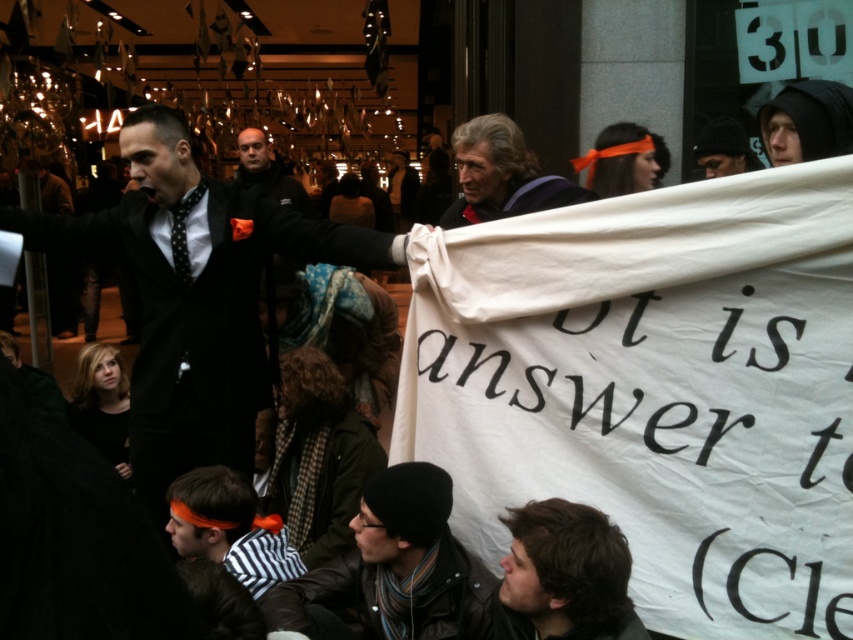
Question: Among these points, which one is nearest to the camera?

Choices:
 (A) tap(363, 573)
 (B) tap(196, 552)

Answer: (A)

Question: Can you confirm if black matte suit at center is positioned to the left of dark brown hair at lower right?

Choices:
 (A) no
 (B) yes

Answer: (B)

Question: Where is black knit cap at lower center located in relation to black knit cap at upper right in the image?

Choices:
 (A) left
 (B) right

Answer: (A)

Question: Which object is farther from the camera taking this photo?

Choices:
 (A) striped fabric shirt at lower left
 (B) gray woolen scarf at center

Answer: (B)

Question: Which point is closer to the camera?

Choices:
 (A) (254, 173)
 (B) (213, 486)
 (C) (155, 364)

Answer: (B)

Question: Can you confirm if black matte suit at center is positioned below gray woolen scarf at center?

Choices:
 (A) yes
 (B) no

Answer: (A)